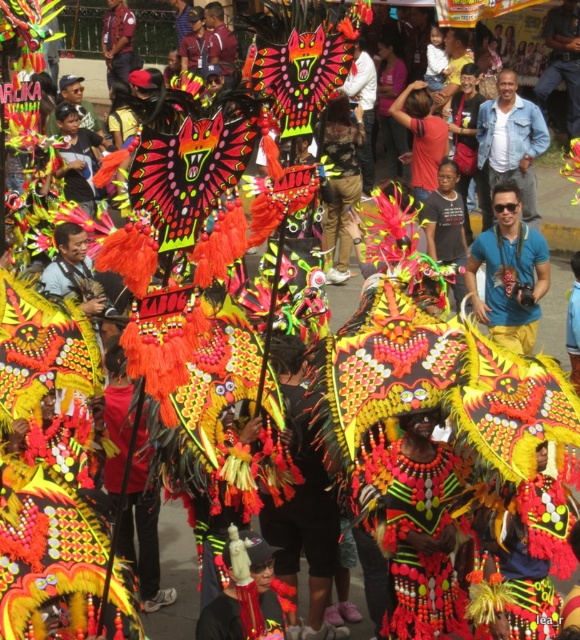
You are observing the performers at the cultural event. Which object is positioned to the left of the other between the blue fabric shirt at center and the blue fabric at center?

The blue fabric shirt at center is to the left of the blue fabric at center.